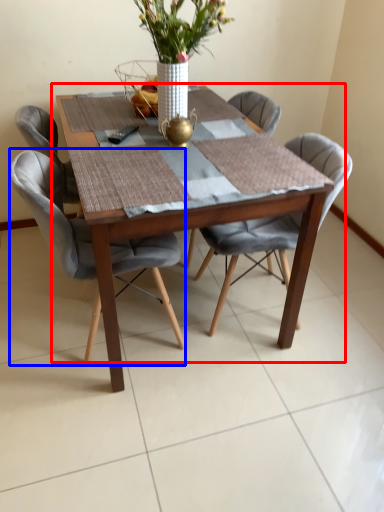
Question: Which point is closer to the camera, kitchen & dining room table (highlighted by a red box) or chair (highlighted by a blue box)?

Choices:
 (A) kitchen & dining room table
 (B) chair

Answer: (A)